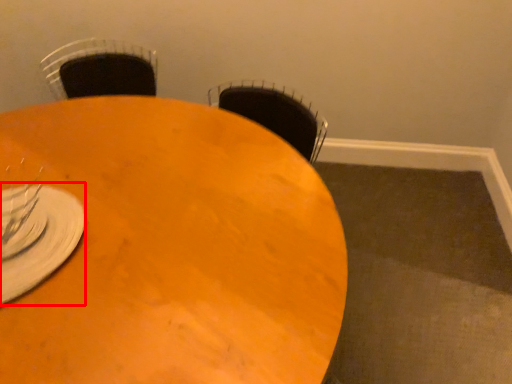
Question: Considering the relative positions of tableware (annotated by the red box) and table in the image provided, where is tableware (annotated by the red box) located with respect to the staircase?

Choices:
 (A) left
 (B) right

Answer: (A)